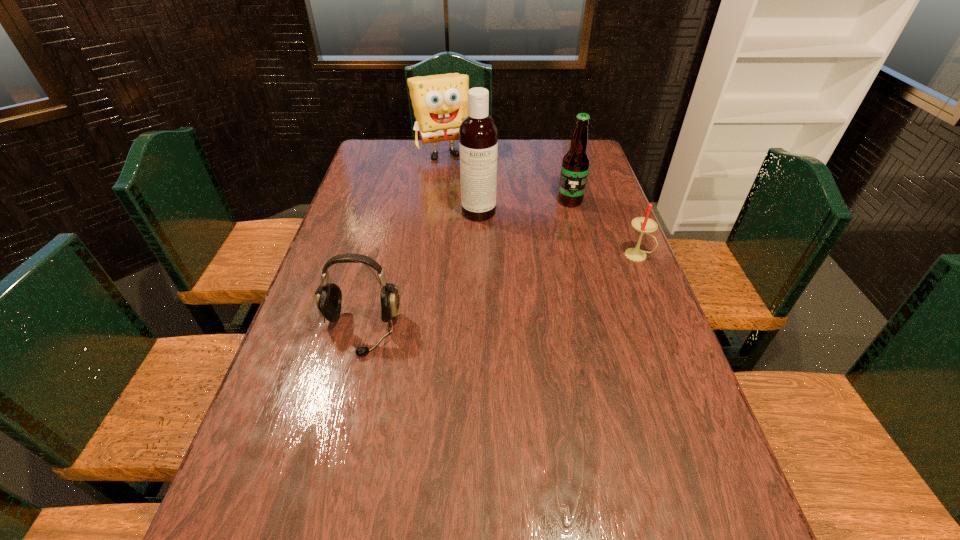
This screenshot has width=960, height=540. Find the location of `beer bottle at the right edge`. beer bottle at the right edge is located at coordinates (575, 166).

I want to click on vacant space at the far edge of the desktop, so click(x=437, y=151).

The width and height of the screenshot is (960, 540). What are the coordinates of `vacant space at the near edge of the desktop` in the screenshot? It's located at point(495,503).

In the image, there is a desktop. Find the location of `vacant space at the left edge`. vacant space at the left edge is located at coordinates (312, 395).

You are a GUI agent. You are given a task and a screenshot of the screen. Output one action in this format:
    pyautogui.click(x=<x>, y=<y>)
    Task: Click on the vacant space at the right edge
    
    Given the screenshot: What is the action you would take?
    pyautogui.click(x=639, y=403)

Find the location of a particular element. vacant space at the far left corner of the desktop is located at coordinates (367, 168).

The image size is (960, 540). Find the location of `free space at the near left corner`. free space at the near left corner is located at coordinates (243, 493).

Find the location of `blank space at the far right corner`. blank space at the far right corner is located at coordinates (563, 152).

The height and width of the screenshot is (540, 960). What are the coordinates of `vacant area between the headset and the candle` in the screenshot? It's located at (498, 293).

In order to click on free space between the sponge and the beer bottle in this screenshot , I will do click(x=506, y=177).